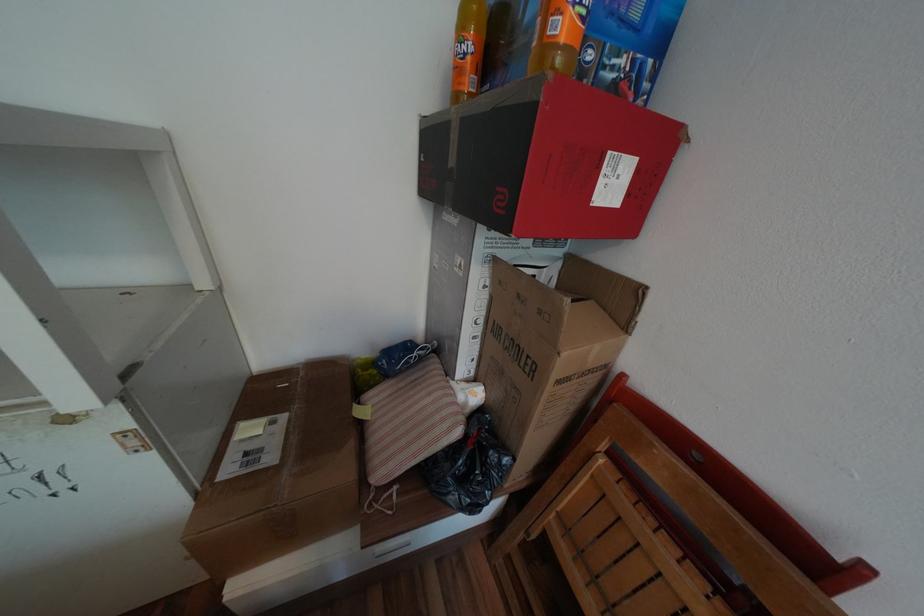
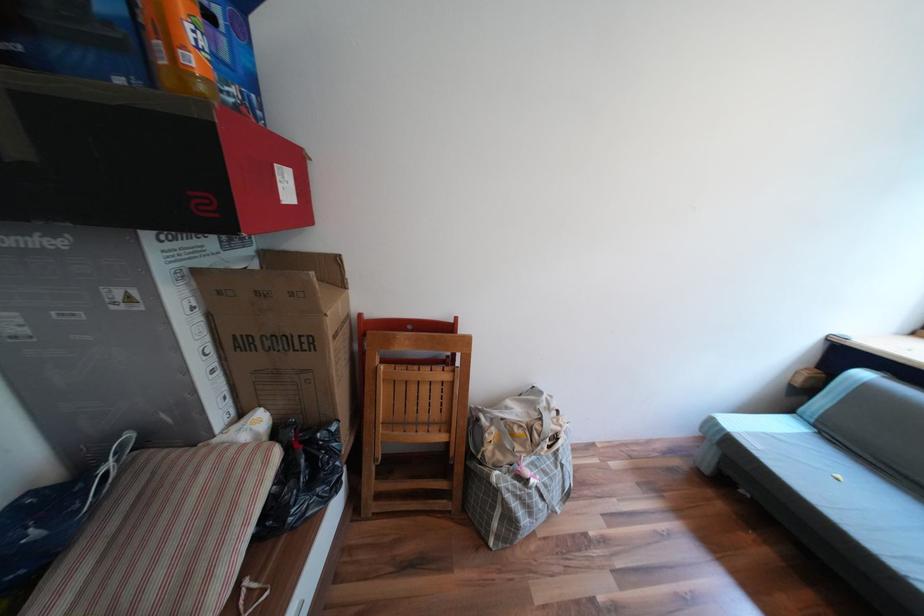
Locate, in the second image, the point that corresponds to point (569, 26) in the first image.

(201, 61)